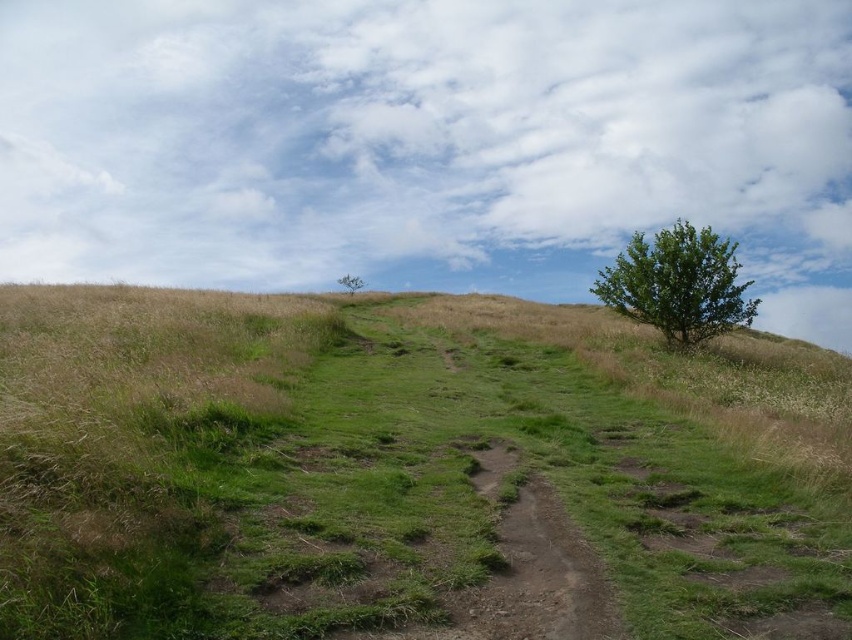
You are standing at the point with coordinates (678,284). You want to walk towards the green leafy tree at right. Which direction should you head?

The green leafy tree at right is located at the point with coordinates (678,284), so you are already at the tree.

You are standing at the point marked by the coordinates point [537,579]. What is the color of the ground beneath your feet?

The ground beneath your feet at point [537,579] is dull brown dirt track at center.

You are standing at the point marked by the coordinates point (407,470). Looking around, you see the green grassy at center. What is the immediate terrain you are standing on?

The point (407,470) corresponds to the green grassy at center, so you are standing on green grassy terrain.